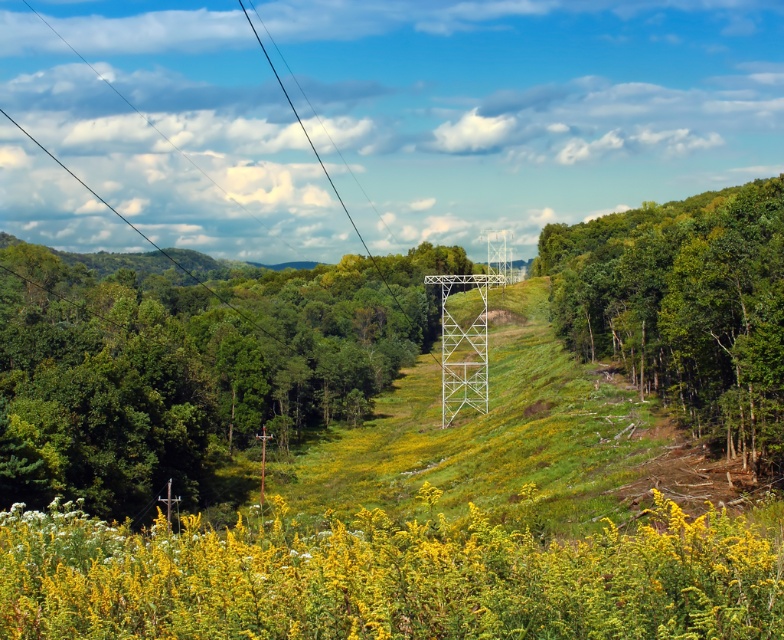
Question: Does green matte tree at center appear under green leafy tree at right?

Choices:
 (A) no
 (B) yes

Answer: (B)

Question: Which of the following is the farthest from the observer?

Choices:
 (A) (311, 330)
 (B) (752, 273)
 (C) (351, 220)
 (D) (379, 566)

Answer: (C)

Question: Does green leafy tree at right lie in front of black wire at upper center?

Choices:
 (A) no
 (B) yes

Answer: (B)

Question: Which point is farther to the camera?

Choices:
 (A) (322, 556)
 (B) (318, 291)
 (C) (332, 186)

Answer: (C)

Question: Is the position of yellow-green textured wildflowers at center more distant than that of black wire at upper center?

Choices:
 (A) yes
 (B) no

Answer: (B)

Question: Which point is farther to the camera?

Choices:
 (A) black wire at upper center
 (B) green leafy tree at right

Answer: (A)